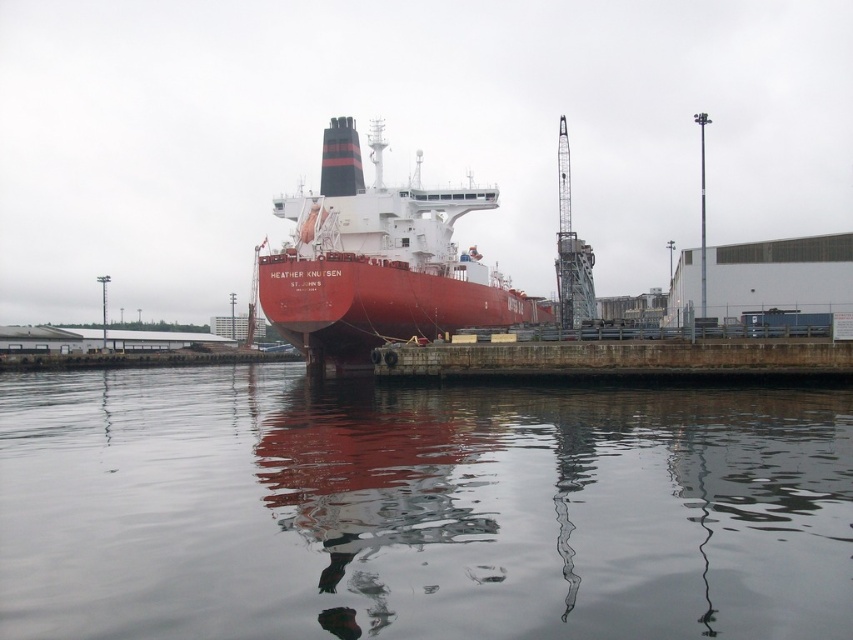
Question: Among these points, which one is nearest to the camera?

Choices:
 (A) (399, 353)
 (B) (822, 400)
 (C) (281, 320)

Answer: (B)

Question: Among these objects, which one is nearest to the camera?

Choices:
 (A) smooth water at center
 (B) concrete at center
 (C) matte red ship at center

Answer: (A)

Question: Which of the following is the farthest from the observer?

Choices:
 (A) concrete at center
 (B) smooth water at center

Answer: (A)

Question: Does matte red ship at center have a larger size compared to concrete at center?

Choices:
 (A) yes
 (B) no

Answer: (A)

Question: Is smooth water at center bigger than concrete at center?

Choices:
 (A) yes
 (B) no

Answer: (A)

Question: Is the position of smooth water at center less distant than that of matte red ship at center?

Choices:
 (A) no
 (B) yes

Answer: (B)